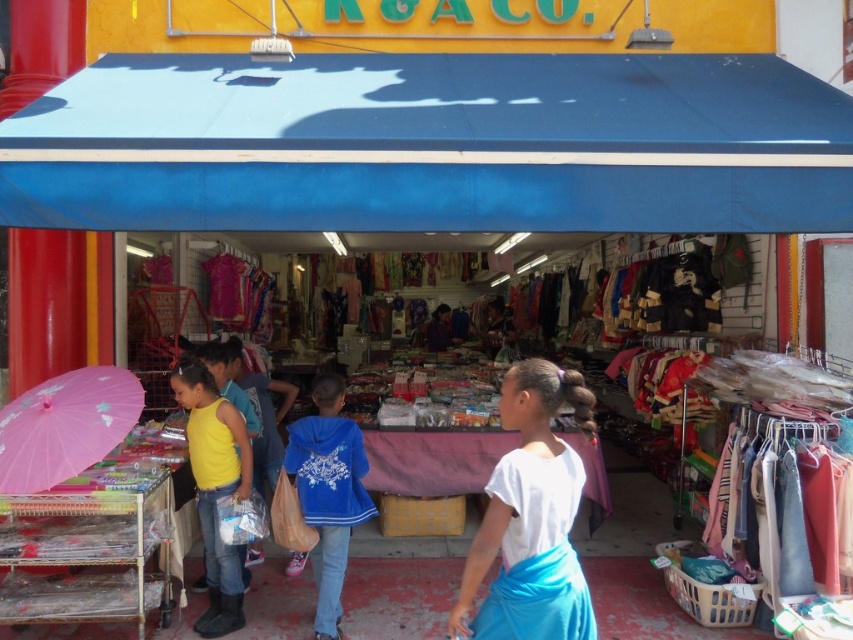
Question: From the image, what is the correct spatial relationship of blue fleece jacket at center in relation to yellow matte tank top at lower left?

Choices:
 (A) left
 (B) right

Answer: (B)

Question: Which point is farther to the camera?

Choices:
 (A) (572, 588)
 (B) (335, 502)
 (C) (297, 72)
 (D) (233, 561)

Answer: (C)

Question: Which point is farther to the camera?

Choices:
 (A) (344, 552)
 (B) (51, 486)

Answer: (A)

Question: Does blue fabric canopy at upper center appear on the left side of white matte shirt at center?

Choices:
 (A) no
 (B) yes

Answer: (B)

Question: Which of these objects is positioned farthest from the yellow matte tank top at lower left?

Choices:
 (A) blue fabric canopy at upper center
 (B) blue fleece jacket at center
 (C) white matte shirt at center
 (D) pink paper umbrella at left

Answer: (C)

Question: Is white matte shirt at center below pink paper umbrella at left?

Choices:
 (A) yes
 (B) no

Answer: (A)